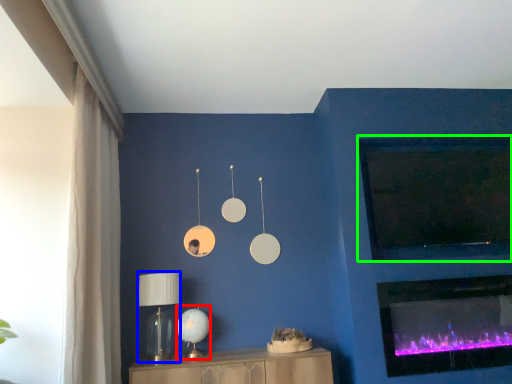
Question: Which object is the closest to the table lamp (highlighted by a red box)? Choose among these: table lamp (highlighted by a blue box) or window screen (highlighted by a green box).

Choices:
 (A) table lamp
 (B) window screen

Answer: (A)